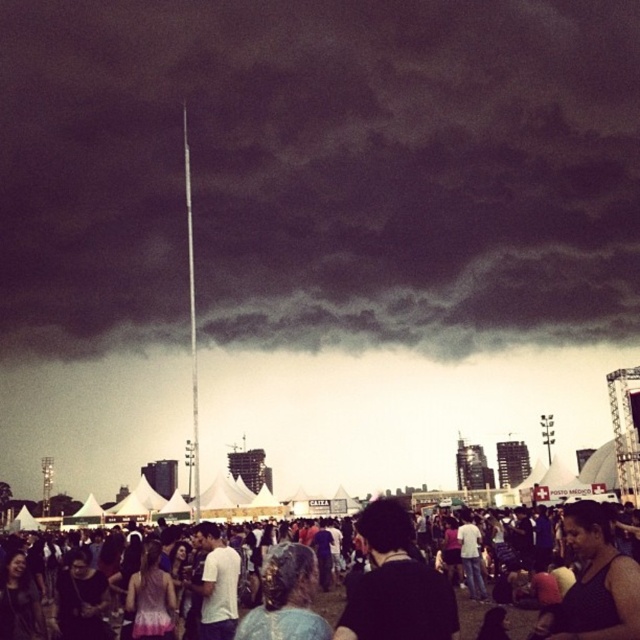
Based on the photo, can you confirm if dark gray metallic pole at upper center is bigger than black tank top at lower right?

Correct, dark gray metallic pole at upper center is larger in size than black tank top at lower right.

Who is lower down, dark gray metallic pole at upper center or black tank top at lower right?

black tank top at lower right

Between point (172, 84) and point (589, 621), which one is positioned behind?

The point (172, 84) is behind.

The width and height of the screenshot is (640, 640). What are the coordinates of `dark gray metallic pole at upper center` in the screenshot? It's located at (317, 173).

Who is taller, black matte hair at center or black tank top at lower right?

black matte hair at center

Is black matte hair at center taller than black tank top at lower right?

Answer: Yes, black matte hair at center is taller than black tank top at lower right.

What are the coordinates of `black matte hair at center` in the screenshot? It's located at (396, 584).

Does dark gray metallic pole at upper center appear on the left side of black matte hair at center?

Indeed, dark gray metallic pole at upper center is positioned on the left side of black matte hair at center.

Where is `dark gray metallic pole at upper center`? This screenshot has height=640, width=640. dark gray metallic pole at upper center is located at coordinates (317, 173).

I want to click on dark gray metallic pole at upper center, so click(x=317, y=173).